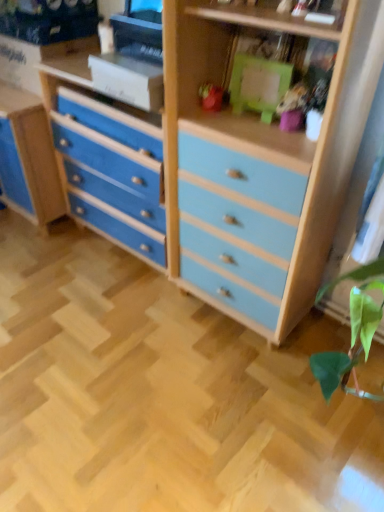
Question: Is matte pink toy at upper center, which appears as the first toy when viewed from the right, in front of or behind matte plastic toy at center, placed as the 1th toy when sorted from left to right, in the image?

Choices:
 (A) front
 (B) behind

Answer: (A)

Question: Based on their sizes in the image, would you say matte pink toy at upper center, the 2th toy positioned from the left, is bigger or smaller than matte plastic toy at center, placed as the 1th toy when sorted from left to right?

Choices:
 (A) small
 (B) big

Answer: (B)

Question: Would you say matte pink toy at upper center, the 2th toy positioned from the left, is inside or outside matte plastic toy at center, placed as the 1th toy when sorted from left to right?

Choices:
 (A) outside
 (B) inside

Answer: (A)

Question: Looking at the image, does matte plastic toy at center, the second toy positioned from the right, seem bigger or smaller compared to matte pink toy at upper center, which appears as the first toy when viewed from the right?

Choices:
 (A) small
 (B) big

Answer: (A)

Question: Is matte plastic toy at center, placed as the 1th toy when sorted from left to right, to the left or to the right of matte pink toy at upper center, the 2th toy positioned from the left, in the image?

Choices:
 (A) left
 (B) right

Answer: (A)

Question: Choose the correct answer: Is matte plastic toy at center, the second toy positioned from the right, inside matte pink toy at upper center, the 2th toy positioned from the left, or outside it?

Choices:
 (A) inside
 (B) outside

Answer: (B)

Question: From a real-world perspective, is matte plastic toy at center, placed as the 1th toy when sorted from left to right, above or below matte pink toy at upper center, the 2th toy positioned from the left?

Choices:
 (A) above
 (B) below

Answer: (B)